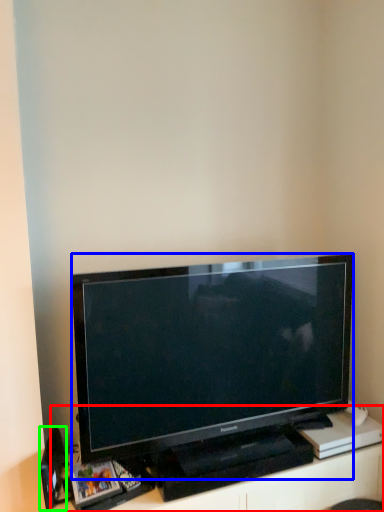
Question: Estimate the real-world distances between objects in this image. Which object is farther from entertainment center (highlighted by a red box), television (highlighted by a blue box) or speaker (highlighted by a green box)?

Choices:
 (A) television
 (B) speaker

Answer: (B)